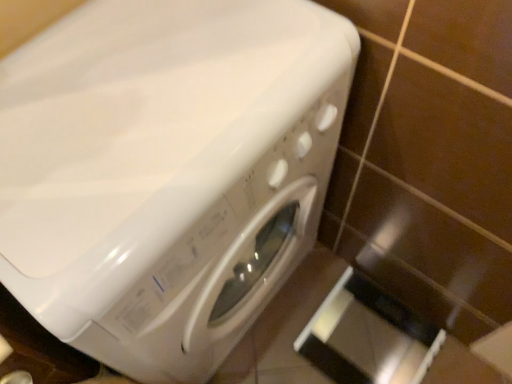
What is the approximate width of white glossy washing machine at upper left?

white glossy washing machine at upper left is 16.10 inches wide.

This screenshot has height=384, width=512. What do you see at coordinates (167, 172) in the screenshot? I see `white glossy washing machine at upper left` at bounding box center [167, 172].

You are a GUI agent. You are given a task and a screenshot of the screen. Output one action in this format:
    pyautogui.click(x=<x>, y=<y>)
    Task: Click on the white glossy washing machine at upper left
    The width and height of the screenshot is (512, 384).
    Given the screenshot: What is the action you would take?
    pyautogui.click(x=167, y=172)

The image size is (512, 384). Identify the location of white glossy washing machine at upper left. (167, 172).